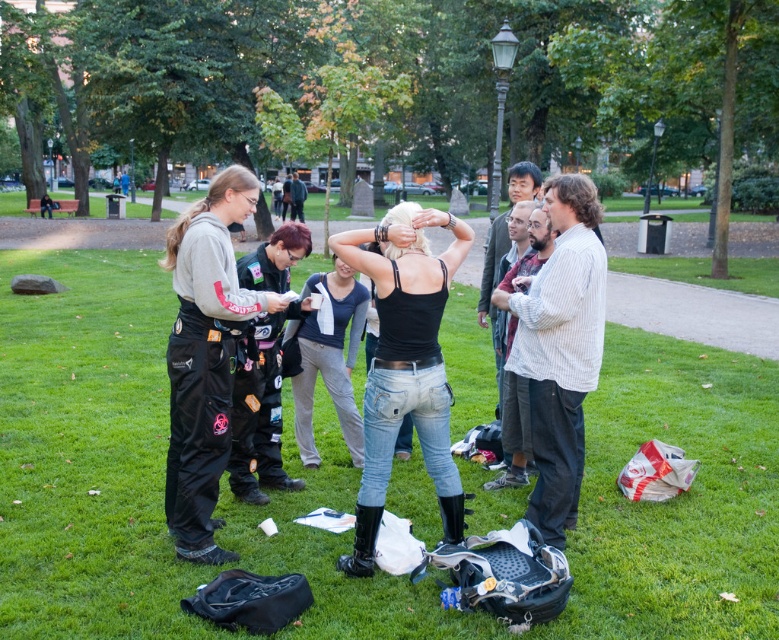
Question: Estimate the real-world distances between objects in this image. Which object is farther from the dark blue jersey at center?

Choices:
 (A) black matte jumpsuit at center
 (B) black matte pants at left
 (C) white striped shirt at center

Answer: (C)

Question: Can you confirm if black leather jacket at center is positioned above dark blue jersey at center?

Choices:
 (A) no
 (B) yes

Answer: (A)

Question: Which object is closer to the camera taking this photo?

Choices:
 (A) black matte jumpsuit at center
 (B) black leather jacket at center
 (C) white striped shirt at center
 (D) green grass at center

Answer: (D)

Question: Based on their relative distances, which object is farther from the dark blue jersey at center?

Choices:
 (A) white striped shirt at center
 (B) black matte jumpsuit at center
 (C) black matte pants at left

Answer: (A)

Question: Can you confirm if black matte tank top at center is positioned below white striped shirt at center?

Choices:
 (A) yes
 (B) no

Answer: (A)

Question: Does black matte jumpsuit at center have a larger size compared to black matte tank top at center?

Choices:
 (A) yes
 (B) no

Answer: (A)